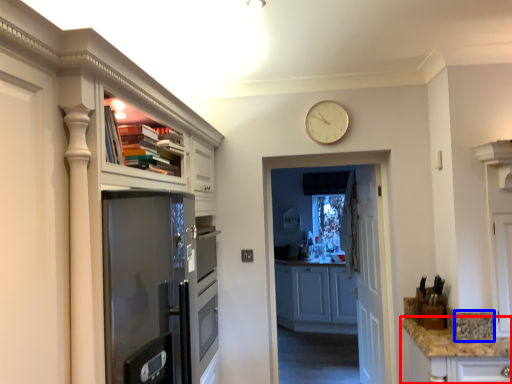
Question: Among these objects, which one is farthest to the camera, counter top (highlighted by a red box) or gray (highlighted by a blue box)?

Choices:
 (A) counter top
 (B) gray

Answer: (B)